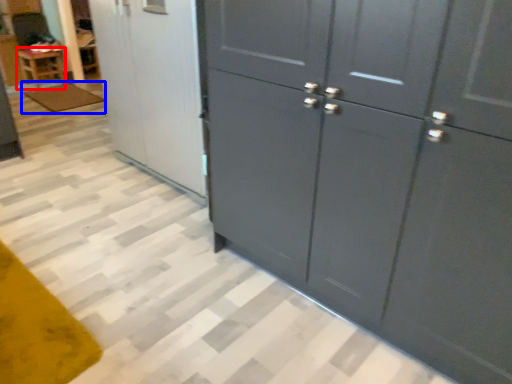
Question: Among these objects, which one is farthest to the camera, furniture (highlighted by a red box) or mat (highlighted by a blue box)?

Choices:
 (A) furniture
 (B) mat

Answer: (A)